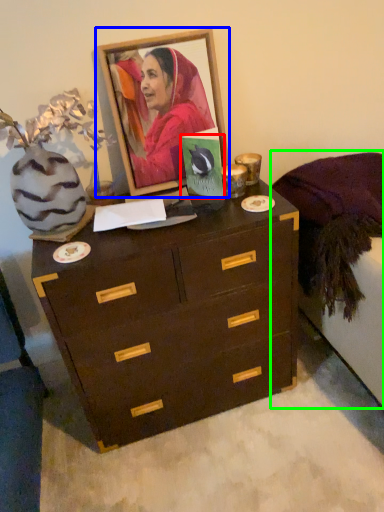
Question: Which object is the farthest from postcard (highlighted by a red box)? Choose among these: picture frame (highlighted by a blue box) or bed frame (highlighted by a green box).

Choices:
 (A) picture frame
 (B) bed frame

Answer: (B)